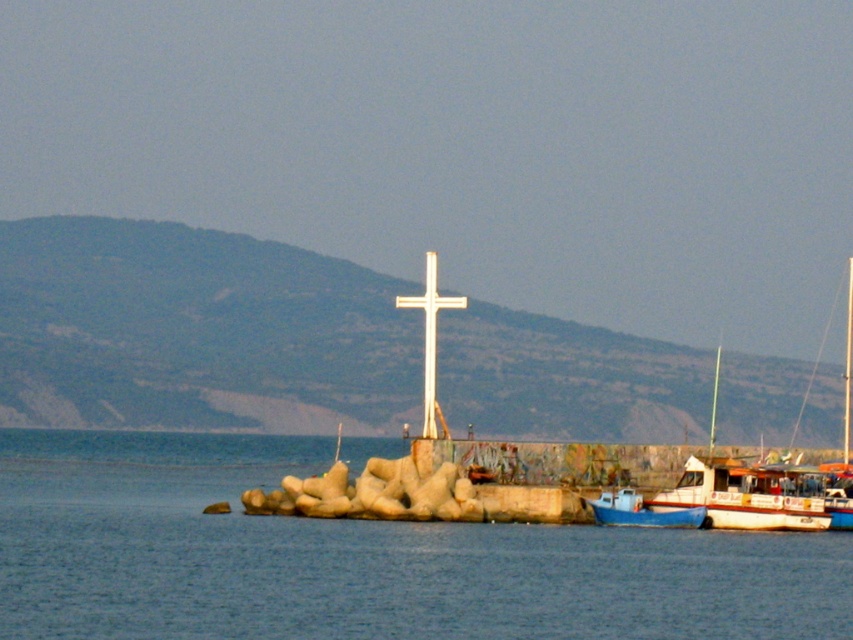
Who is positioned more to the left, white plastic boat at lower right or blue matte boat at lower right?

From the viewer's perspective, blue matte boat at lower right appears more on the left side.

How far apart are white plastic boat at lower right and blue matte boat at lower right?

A distance of 5.64 meters exists between white plastic boat at lower right and blue matte boat at lower right.

The image size is (853, 640). Describe the element at coordinates (747, 496) in the screenshot. I see `white plastic boat at lower right` at that location.

Find the location of `white plastic boat at lower right`. white plastic boat at lower right is located at coordinates (747, 496).

Can you confirm if blue water at center is shorter than white plastic boat at lower right?

No.

Describe the element at coordinates (358, 557) in the screenshot. I see `blue water at center` at that location.

Identify the location of blue water at center. (358, 557).

Locate an element on the screen. The height and width of the screenshot is (640, 853). white metallic cross at center is located at coordinates (430, 337).

Can you confirm if white metallic cross at center is positioned to the right of blue matte boat at lower right?

Incorrect, white metallic cross at center is not on the right side of blue matte boat at lower right.

Between point (425, 285) and point (633, 516), which one is positioned behind?

Point (425, 285)

Where is `white metallic cross at center`? This screenshot has height=640, width=853. white metallic cross at center is located at coordinates (430, 337).